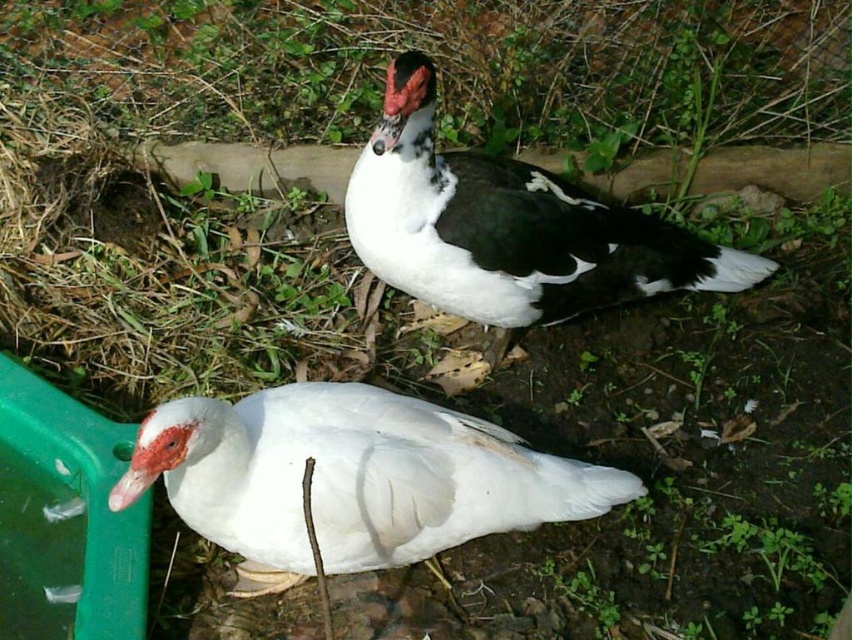
You are a birdwatcher observing two ducks in a garden. You see the white matte duck at lower left and the white matte duck at center. Which duck is taller?

The white matte duck at center is taller than the white matte duck at lower left.

You are observing two ducks in a garden. The first duck is the white matte duck at lower left, and the second is the white matte duck at center. From your viewpoint, which duck is positioned lower in the image?

The white matte duck at lower left is positioned lower than the white matte duck at center, so the white matte duck at lower left is lower in the image.